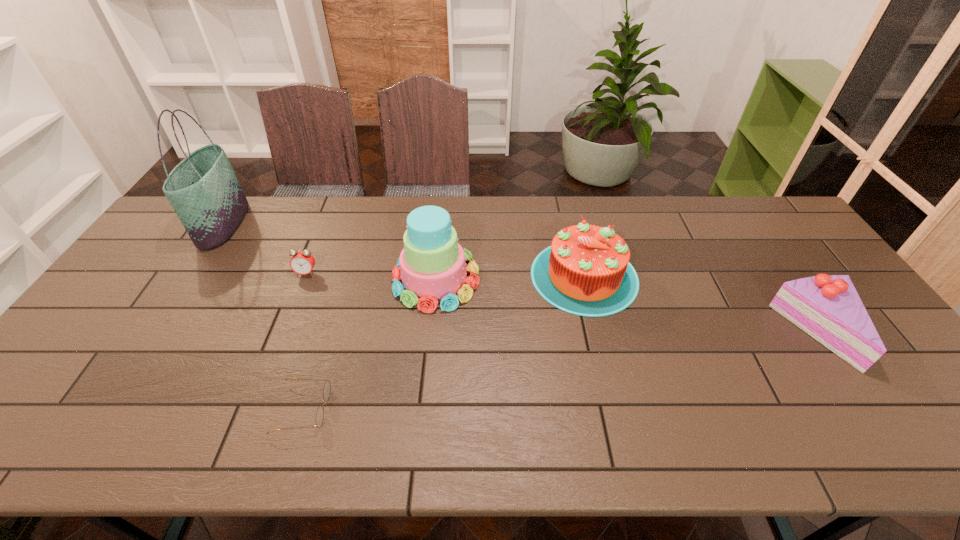
At what (x,y) coordinates should I click in order to perform the action: click on tote bag. Please return your answer as a coordinate pair (x, y). Looking at the image, I should click on (203, 189).

Identify the location of the tallest object. (203, 189).

Find the location of a particular element. The height and width of the screenshot is (540, 960). the second tallest object is located at coordinates (432, 265).

This screenshot has height=540, width=960. I want to click on the fourth object from left to right, so click(432, 265).

Locate an element on the screen. the second cake from right to left is located at coordinates (586, 271).

You are a GUI agent. You are given a task and a screenshot of the screen. Output one action in this format:
    pyautogui.click(x=<x>, y=<y>)
    Task: Click on the second tallest cake
    The width and height of the screenshot is (960, 540).
    Given the screenshot: What is the action you would take?
    pyautogui.click(x=586, y=271)

At what (x,y) coordinates should I click in order to perform the action: click on the rightmost object. Please return your answer as a coordinate pair (x, y). This screenshot has width=960, height=540. Looking at the image, I should click on (827, 307).

Where is `the rightmost cake`? The width and height of the screenshot is (960, 540). the rightmost cake is located at coordinates (827, 307).

Where is `alarm clock`? alarm clock is located at coordinates (302, 262).

Where is `the second object from left to right`? the second object from left to right is located at coordinates (302, 262).